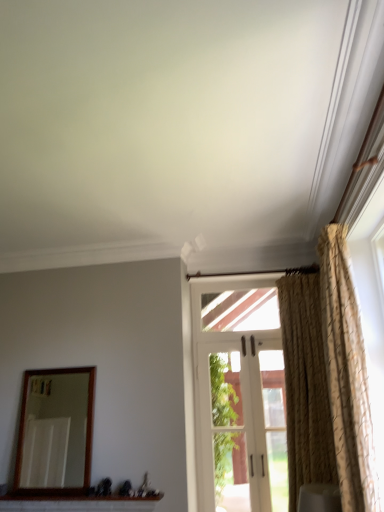
Question: Is beige textured curtain at right, the 1th curtain when ordered from back to front, a part of white fabric curtain at right?

Choices:
 (A) no
 (B) yes

Answer: (A)

Question: From the image's perspective, does white fabric curtain at right appear higher than beige textured curtain at right, which is the 2th curtain from front to back?

Choices:
 (A) no
 (B) yes

Answer: (A)

Question: Is white fabric curtain at right next to beige textured curtain at right, which is the 2th curtain from front to back, and touching it?

Choices:
 (A) no
 (B) yes

Answer: (A)

Question: Is white fabric curtain at right taller than beige textured curtain at right, the 1th curtain when ordered from back to front?

Choices:
 (A) yes
 (B) no

Answer: (B)

Question: From a real-world perspective, is white fabric curtain at right physically above beige textured curtain at right, the 1th curtain when ordered from back to front?

Choices:
 (A) yes
 (B) no

Answer: (B)

Question: Is white fabric curtain at right wider or thinner than wooden-framed mirror at left?

Choices:
 (A) thin
 (B) wide

Answer: (B)

Question: In terms of height, does white fabric curtain at right look taller or shorter compared to wooden-framed mirror at left?

Choices:
 (A) short
 (B) tall

Answer: (A)

Question: Looking at the image, does white fabric curtain at right seem bigger or smaller compared to wooden-framed mirror at left?

Choices:
 (A) small
 (B) big

Answer: (A)

Question: Is white fabric curtain at right in front of or behind wooden-framed mirror at left in the image?

Choices:
 (A) behind
 (B) front

Answer: (B)

Question: Is white fabric curtain at right bigger or smaller than white brick window sill at lower center?

Choices:
 (A) small
 (B) big

Answer: (B)

Question: Is white fabric curtain at right wider or thinner than white brick window sill at lower center?

Choices:
 (A) thin
 (B) wide

Answer: (B)

Question: From a real-world perspective, is white fabric curtain at right physically located above or below white brick window sill at lower center?

Choices:
 (A) above
 (B) below

Answer: (A)

Question: Considering the positions of point (304, 507) and point (11, 505), is point (304, 507) closer or farther from the camera than point (11, 505)?

Choices:
 (A) farther
 (B) closer

Answer: (B)

Question: From the image's perspective, is white brick window sill at lower center above or below gold textured curtain at right, which appears as the 2th curtain when viewed from the back?

Choices:
 (A) above
 (B) below

Answer: (B)

Question: Considering the positions of point (137, 506) and point (332, 224), is point (137, 506) closer or farther from the camera than point (332, 224)?

Choices:
 (A) closer
 (B) farther

Answer: (B)